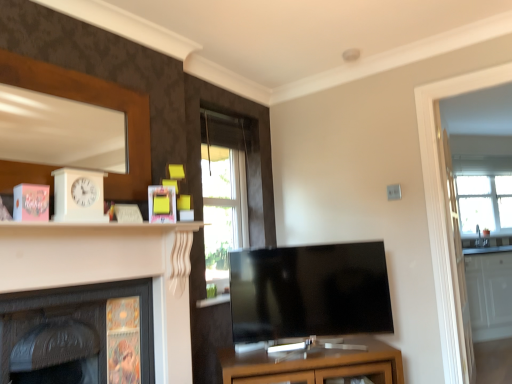
Question: Does yellow matte picture frame at upper center appear on the right side of matte brown cabinet at center?

Choices:
 (A) yes
 (B) no

Answer: (B)

Question: Is yellow matte picture frame at upper center closer to the viewer compared to matte brown cabinet at center?

Choices:
 (A) no
 (B) yes

Answer: (B)

Question: Are yellow matte picture frame at upper center and matte brown cabinet at center far apart?

Choices:
 (A) no
 (B) yes

Answer: (B)

Question: Considering the relative sizes of yellow matte picture frame at upper center and matte brown cabinet at center in the image provided, is yellow matte picture frame at upper center bigger than matte brown cabinet at center?

Choices:
 (A) no
 (B) yes

Answer: (A)

Question: From a real-world perspective, does yellow matte picture frame at upper center stand above matte brown cabinet at center?

Choices:
 (A) no
 (B) yes

Answer: (B)

Question: Is point (169, 210) closer or farther from the camera than point (162, 284)?

Choices:
 (A) closer
 (B) farther

Answer: (B)

Question: From the image's perspective, is yellow matte picture frame at upper center positioned above or below white glossy fireplace at left, which is the 2th fireplace from left to right?

Choices:
 (A) above
 (B) below

Answer: (A)

Question: Looking at their shapes, would you say yellow matte picture frame at upper center is wider or thinner than white glossy fireplace at left, which is the 2th fireplace from left to right?

Choices:
 (A) thin
 (B) wide

Answer: (A)

Question: In the image, is yellow matte picture frame at upper center positioned in front of or behind white glossy fireplace at left, which is the 2th fireplace from left to right?

Choices:
 (A) behind
 (B) front

Answer: (A)

Question: In the image, is yellow matte picture frame at upper center on the left side or the right side of clear glass window at right, which is the first window from right to left?

Choices:
 (A) right
 (B) left

Answer: (B)

Question: Is yellow matte picture frame at upper center situated inside clear glass window at right, which is the first window from right to left, or outside?

Choices:
 (A) outside
 (B) inside

Answer: (A)

Question: Is yellow matte picture frame at upper center wider or thinner than clear glass window at right, the second window when ordered from front to back?

Choices:
 (A) wide
 (B) thin

Answer: (B)

Question: Relative to clear glass window at right, which is the first window from right to left, is yellow matte picture frame at upper center in front or behind?

Choices:
 (A) behind
 (B) front

Answer: (B)

Question: Relative to dark wood fireplace at lower left, which is the 2th fireplace from right to left, is white glossy fireplace at left, positioned as the first fireplace in right-to-left order, in front or behind?

Choices:
 (A) front
 (B) behind

Answer: (A)

Question: Considering the positions of white glossy fireplace at left, positioned as the first fireplace in right-to-left order, and dark wood fireplace at lower left, placed as the first fireplace when sorted from left to right, in the image, is white glossy fireplace at left, positioned as the first fireplace in right-to-left order, taller or shorter than dark wood fireplace at lower left, placed as the first fireplace when sorted from left to right,?

Choices:
 (A) tall
 (B) short

Answer: (A)